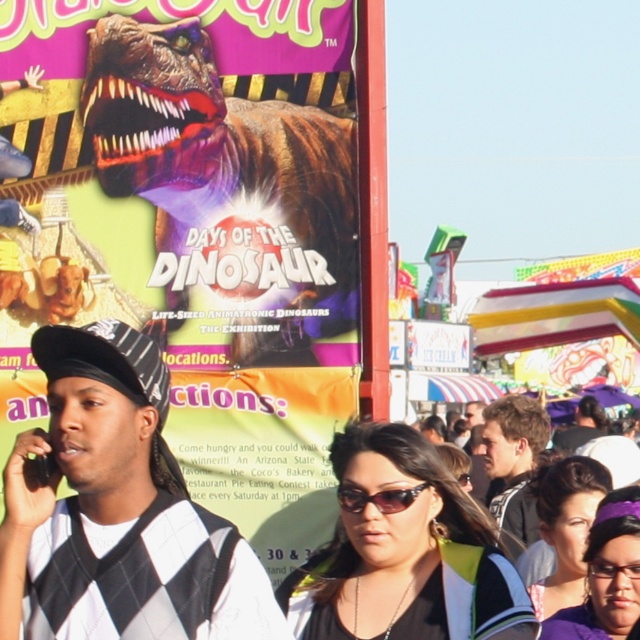
Question: Considering the real-world distances, which object is farthest from the transparent plastic goggles at lower center?

Choices:
 (A) light brown hair at center
 (B) black argyle sweater vest at left

Answer: (B)

Question: Is black argyle sweater vest at left wider than black plastic sunglasses at center?

Choices:
 (A) no
 (B) yes

Answer: (B)

Question: In this image, where is matte purple hair at lower right located relative to black plastic sunglasses at center?

Choices:
 (A) left
 (B) right

Answer: (B)

Question: Which point is closer to the camera?

Choices:
 (A) (404, 451)
 (B) (19, 176)
 (C) (621, 572)
 (D) (634, 588)

Answer: (D)

Question: Which point is farther from the camera taking this photo?

Choices:
 (A) (545, 442)
 (B) (401, 493)
 (C) (452, 579)
 (D) (58, 556)

Answer: (A)

Question: Does light brown hair at center appear under dark brown hair at center?

Choices:
 (A) no
 (B) yes

Answer: (A)